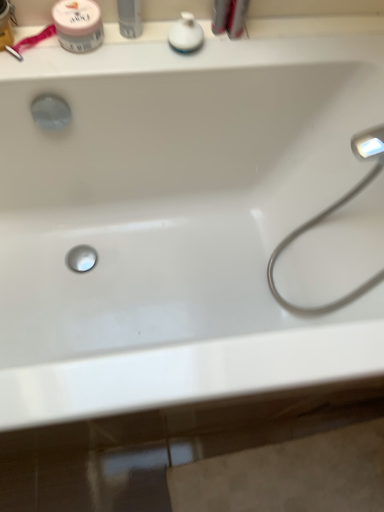
Question: From their relative heights in the image, would you say white glossy spray can at upper center, which is the 1th toiletry in left-to-right order, is taller or shorter than satin nickel faucet at right?

Choices:
 (A) short
 (B) tall

Answer: (A)

Question: Would you say white glossy spray can at upper center, which is the 1th toiletry in left-to-right order, is to the left or to the right of satin nickel faucet at right in the picture?

Choices:
 (A) left
 (B) right

Answer: (A)

Question: Based on their relative distances, which object is nearer to the satin nickel faucet at right?

Choices:
 (A) white glossy soap dispenser at upper center, which is counted as the 2th toiletry, starting from the left
 (B) pink matte jar at upper left
 (C) white glossy spray can at upper center, which is the second toiletry from right to left

Answer: (A)

Question: Which object is the closest to the white glossy soap dispenser at upper center, which is counted as the first toiletry, starting from the right?

Choices:
 (A) white glossy spray can at upper center, which is the second toiletry from right to left
 (B) satin nickel faucet at right
 (C) pink matte jar at upper left

Answer: (A)